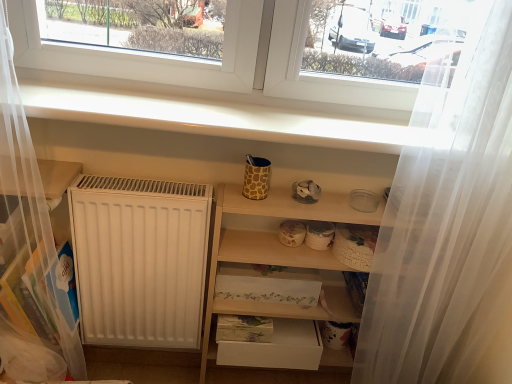
Question: Is wooden shelves at center turned away from white sheer curtain at right?

Choices:
 (A) no
 (B) yes

Answer: (A)

Question: Is wooden shelves at center at the left side of white sheer curtain at right?

Choices:
 (A) yes
 (B) no

Answer: (A)

Question: From a real-world perspective, is wooden shelves at center on top of white sheer curtain at right?

Choices:
 (A) yes
 (B) no

Answer: (B)

Question: From the image's perspective, is wooden shelves at center on white sheer curtain at right?

Choices:
 (A) yes
 (B) no

Answer: (B)

Question: Could you tell me if wooden shelves at center is facing white sheer curtain at right?

Choices:
 (A) yes
 (B) no

Answer: (A)

Question: Considering the relative sizes of wooden shelves at center and white sheer curtain at right in the image provided, is wooden shelves at center smaller than white sheer curtain at right?

Choices:
 (A) yes
 (B) no

Answer: (B)

Question: Is white matte drawer at lower center wider than wooden shelves at center?

Choices:
 (A) no
 (B) yes

Answer: (A)

Question: Is white matte drawer at lower center facing away from wooden shelves at center?

Choices:
 (A) yes
 (B) no

Answer: (A)

Question: Is white matte drawer at lower center located outside wooden shelves at center?

Choices:
 (A) no
 (B) yes

Answer: (A)

Question: From a real-world perspective, is white matte drawer at lower center positioned under wooden shelves at center based on gravity?

Choices:
 (A) no
 (B) yes

Answer: (B)

Question: Considering the relative positions of white matte drawer at lower center and wooden shelves at center in the image provided, is white matte drawer at lower center to the left of wooden shelves at center from the viewer's perspective?

Choices:
 (A) no
 (B) yes

Answer: (B)

Question: Is white matte drawer at lower center beside wooden shelves at center?

Choices:
 (A) no
 (B) yes

Answer: (A)

Question: From the image's perspective, would you say wooden shelves at center is positioned over white matte drawer at lower center?

Choices:
 (A) yes
 (B) no

Answer: (A)